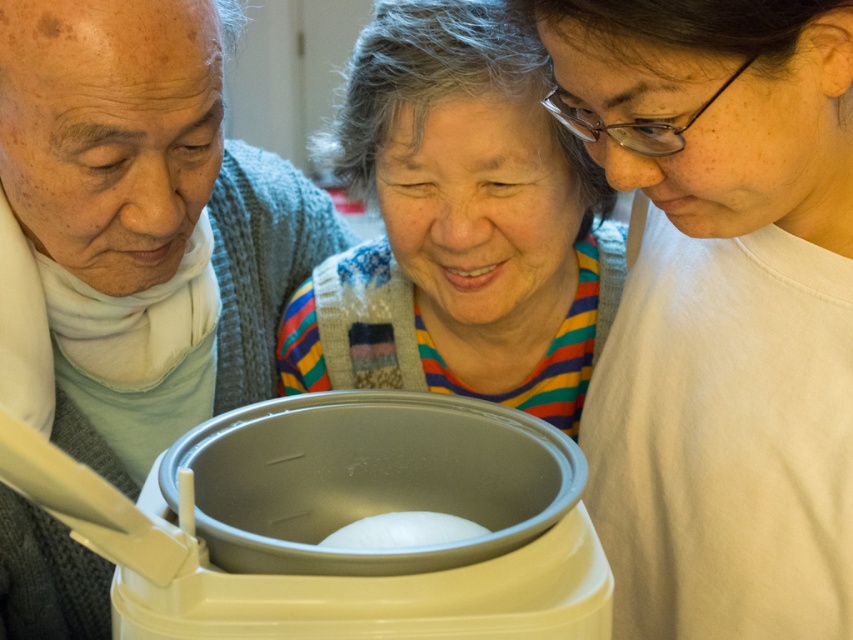
Question: Observing the image, what is the correct spatial positioning of white matte shirt at lower right in reference to matte gray sweater at left?

Choices:
 (A) left
 (B) right

Answer: (B)

Question: Is white matte shirt at lower right further to the viewer compared to white matte ball at center?

Choices:
 (A) no
 (B) yes

Answer: (A)

Question: Which object appears farthest from the camera in this image?

Choices:
 (A) white matte shirt at lower right
 (B) striped sweater at center

Answer: (B)

Question: Considering the real-world distances, which object is farthest from the matte gray sweater at left?

Choices:
 (A) white matte shirt at lower right
 (B) white matte ball at center
 (C) striped sweater at center

Answer: (A)

Question: Among these objects, which one is nearest to the camera?

Choices:
 (A) matte gray sweater at left
 (B) white matte shirt at lower right

Answer: (B)

Question: Is striped sweater at center positioned at the back of white matte ball at center?

Choices:
 (A) yes
 (B) no

Answer: (A)